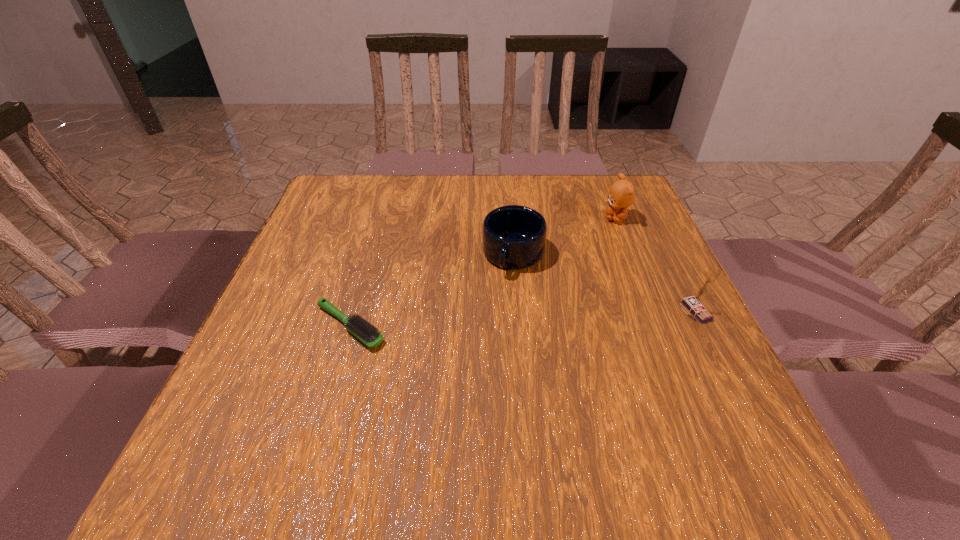
I want to click on vacant position in the image that satisfies the following two spatial constraints: 1. on the back side of the leftmost object; 2. on the left side of the mug, so point(371,255).

Find the location of a particular element. This screenshot has width=960, height=540. vacant space that satisfies the following two spatial constraints: 1. on the front side of the rightmost object; 2. on the left side of the third object from right to left is located at coordinates (518, 311).

Locate an element on the screen. The width and height of the screenshot is (960, 540). free location that satisfies the following two spatial constraints: 1. on the back side of the teddy bear; 2. on the left side of the shortest object is located at coordinates (381, 219).

Identify the location of free spot that satisfies the following two spatial constraints: 1. on the back side of the third object from left to right; 2. on the left side of the third object from right to left. This screenshot has height=540, width=960. (511, 219).